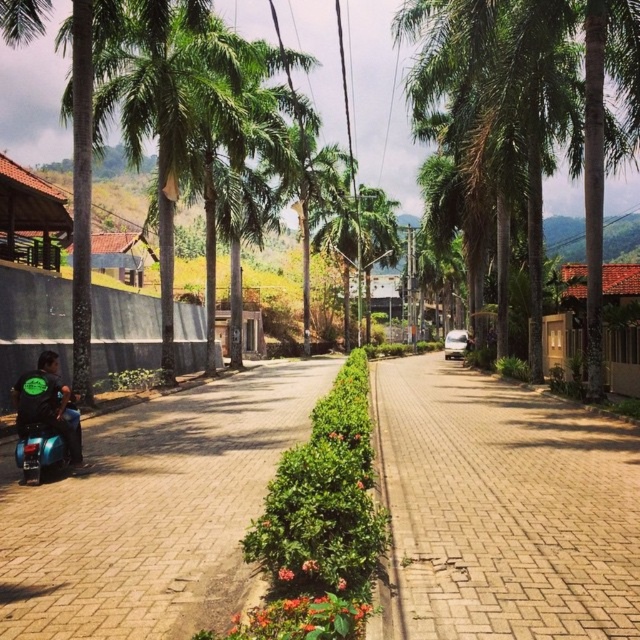
Is point (420, 358) positioned after point (237, 556)?

Yes, point (420, 358) is behind point (237, 556).

Does brick paved road at center have a smaller size compared to blue glossy scooter at lower left?

No, brick paved road at center is not smaller than blue glossy scooter at lower left.

Describe the element at coordinates (504, 508) in the screenshot. I see `brick paved road at center` at that location.

Identify the location of brick paved road at center. This screenshot has width=640, height=640. (504, 508).

Can you confirm if brick paved road at center is positioned below dark green fabric motorcyclist at lower left?

Yes, brick paved road at center is below dark green fabric motorcyclist at lower left.

Who is taller, brick paved road at center or dark green fabric motorcyclist at lower left?

dark green fabric motorcyclist at lower left is taller.

I want to click on brick paved road at center, so click(x=504, y=508).

Is blue glossy scooter at lower left in front of dark green fabric motorcyclist at lower left?

Yes.

Measure the distance between point (317, 380) and camera.

24.00 meters

The image size is (640, 640). I want to click on blue glossy scooter at lower left, so click(152, 512).

The height and width of the screenshot is (640, 640). Identify the location of blue glossy scooter at lower left. (152, 512).